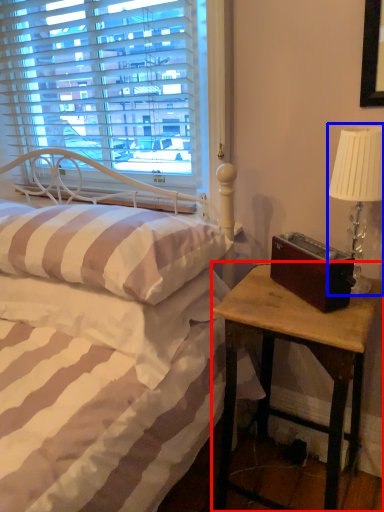
Question: Which point is closer to the camera, nightstand (highlighted by a red box) or table lamp (highlighted by a blue box)?

Choices:
 (A) nightstand
 (B) table lamp

Answer: (A)